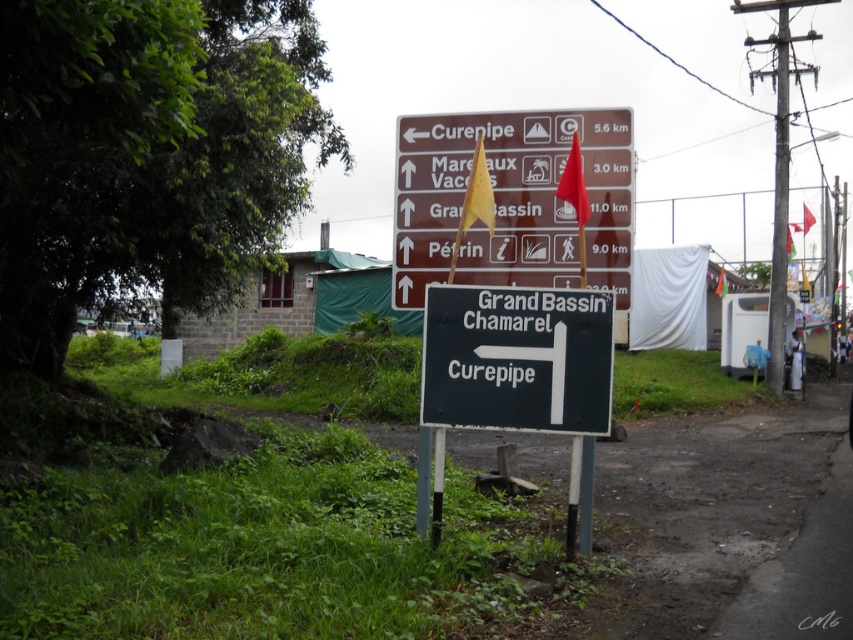
You are a tourist driving along this road and see the image. You need to decide whether to follow the black plastic sign at center or the red fabric flag at center. Based on their positions, which one is positioned higher and should you follow that one?

The red fabric flag at center is positioned higher than the black plastic sign at center. Typically, higher positioned signs or flags on such directional boards might indicate more prominent or primary directions. However, since the question is about spatial position, the red fabric flag at center is higher, so if following the higher one, you should follow the red fabric flag at center.

You are a tourist driving along this road and see both the brown wooden sign at center and the black plastic sign at center. According to their positions, which one is located to the right side?

The brown wooden sign at center is to the right of the black plastic sign at center, so the brown wooden sign at center is located to the right side.